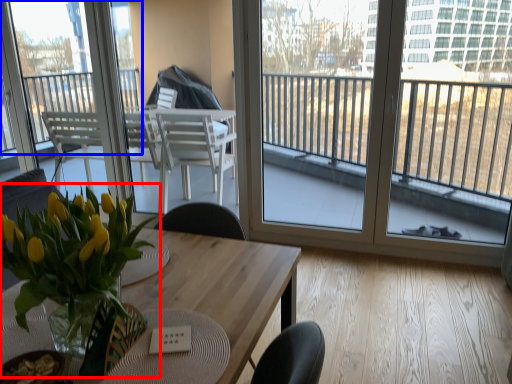
Question: Which of the following is the farthest to the observer, houseplant (highlighted by a red box) or window (highlighted by a blue box)?

Choices:
 (A) houseplant
 (B) window

Answer: (B)